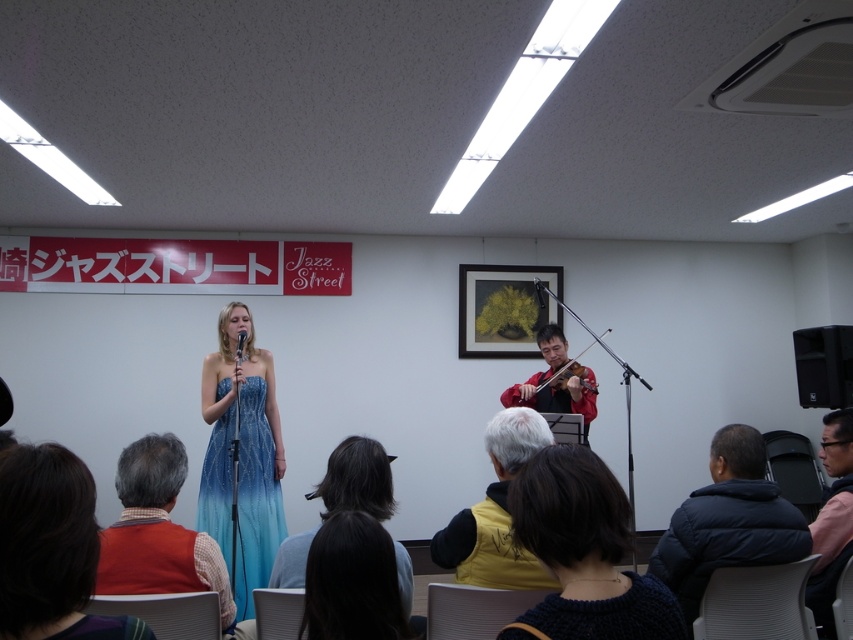
Does point (367, 460) lie behind point (540, 294)?

No.

From the picture: Does blue denim dress at center have a smaller size compared to metallic silver microphone at upper center?

No.

In order to click on blue denim dress at center in this screenshot , I will do `click(357, 480)`.

Is black puffer jacket at lower right above dark brown hair at lower center?

Incorrect, black puffer jacket at lower right is not positioned above dark brown hair at lower center.

Which of these two, black puffer jacket at lower right or dark brown hair at lower center, stands shorter?

Standing shorter between the two is dark brown hair at lower center.

Locate an element on the screen. black puffer jacket at lower right is located at coordinates (728, 522).

Find the location of `black puffer jacket at lower right`. black puffer jacket at lower right is located at coordinates (728, 522).

Who is lower down, orange knit sweater at lower left or blue satin dress at center?

blue satin dress at center is lower down.

The image size is (853, 640). I want to click on orange knit sweater at lower left, so click(158, 532).